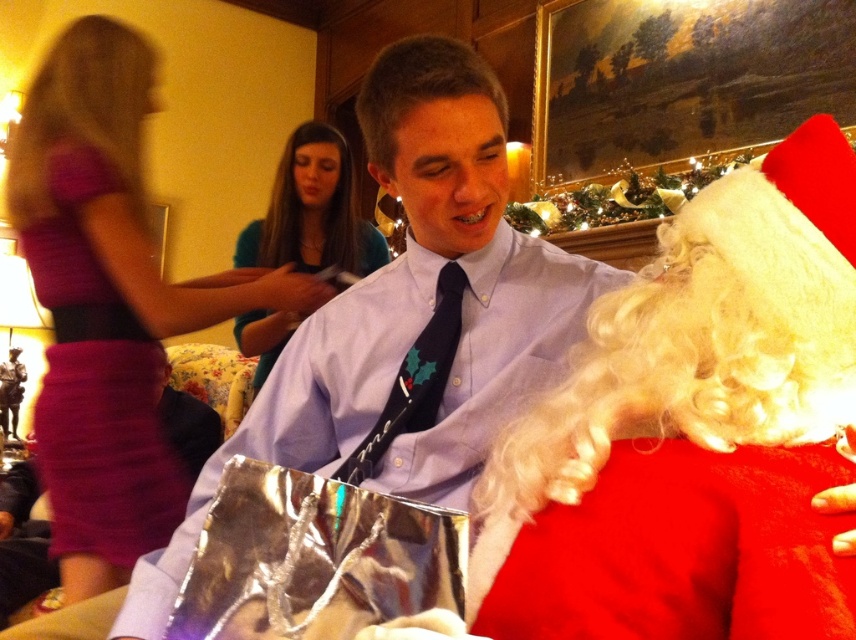
Locate an element on the screen. red fuzzy santa at right is located at coordinates (694, 429).

Is red fuzzy santa at right further to camera compared to black satin tie at center?

No, red fuzzy santa at right is in front of black satin tie at center.

Who is more distant from viewer, (x=831, y=304) or (x=384, y=420)?

Point (x=384, y=420)

Locate an element on the screen. Image resolution: width=856 pixels, height=640 pixels. red fuzzy santa at right is located at coordinates (694, 429).

Can you confirm if shiny metallic bag at lower center is wider than purple satin dress at left?

No, shiny metallic bag at lower center is not wider than purple satin dress at left.

Who is positioned more to the left, shiny metallic bag at lower center or purple satin dress at left?

purple satin dress at left

Which is in front, point (250, 573) or point (117, 316)?

Positioned in front is point (250, 573).

You are a GUI agent. You are given a task and a screenshot of the screen. Output one action in this format:
    pyautogui.click(x=<x>, y=<y>)
    Task: Click on the shiny metallic bag at lower center
    The image size is (856, 640).
    Given the screenshot: What is the action you would take?
    pyautogui.click(x=314, y=557)

Which is more to the right, shiny metallic bag at lower center or frosted glass bowl at upper center?

Positioned to the right is frosted glass bowl at upper center.

Is shiny metallic bag at lower center positioned at the back of frosted glass bowl at upper center?

That is False.

Where is `shiny metallic bag at lower center`? shiny metallic bag at lower center is located at coordinates (314, 557).

Where is `shiny metallic bag at lower center`? Image resolution: width=856 pixels, height=640 pixels. shiny metallic bag at lower center is located at coordinates (314, 557).